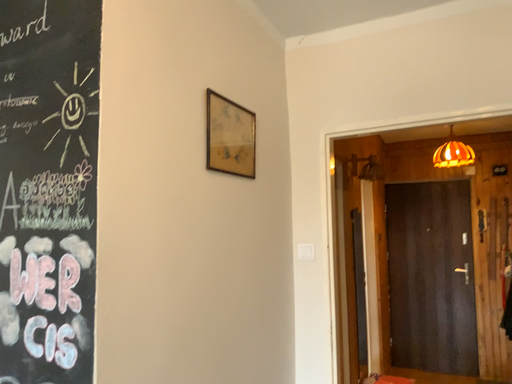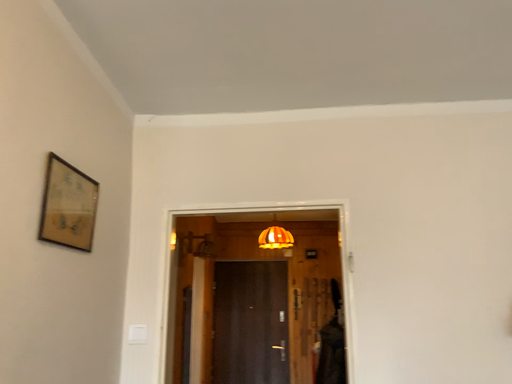
Question: How did the camera likely rotate when shooting the video?

Choices:
 (A) rotated right
 (B) rotated left

Answer: (A)